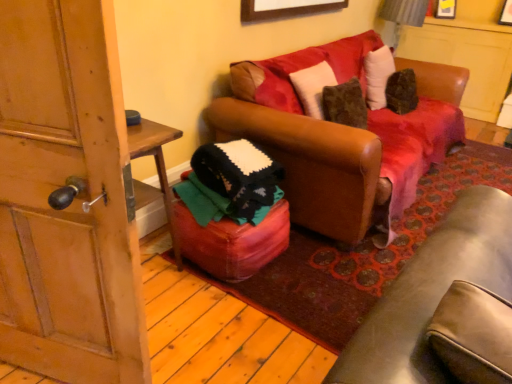
Question: From the image's perspective, is brown leather couch at center over wooden door at left?

Choices:
 (A) no
 (B) yes

Answer: (B)

Question: Is brown leather couch at center facing towards wooden door at left?

Choices:
 (A) no
 (B) yes

Answer: (A)

Question: Is brown leather couch at center shorter than wooden door at left?

Choices:
 (A) yes
 (B) no

Answer: (A)

Question: Does brown leather couch at center touch wooden door at left?

Choices:
 (A) no
 (B) yes

Answer: (A)

Question: Is brown leather couch at center not within wooden door at left?

Choices:
 (A) no
 (B) yes

Answer: (B)

Question: From the image's perspective, does brown leather couch at center appear lower than wooden door at left?

Choices:
 (A) no
 (B) yes

Answer: (A)

Question: Does wooden picture frame at upper center turn towards leather ottoman at center?

Choices:
 (A) yes
 (B) no

Answer: (B)

Question: Does wooden picture frame at upper center have a lesser height compared to leather ottoman at center?

Choices:
 (A) yes
 (B) no

Answer: (A)

Question: Is wooden picture frame at upper center looking in the opposite direction of leather ottoman at center?

Choices:
 (A) yes
 (B) no

Answer: (B)

Question: From the image's perspective, would you say wooden picture frame at upper center is positioned over leather ottoman at center?

Choices:
 (A) yes
 (B) no

Answer: (A)

Question: Considering the relative positions of wooden picture frame at upper center and leather ottoman at center in the image provided, is wooden picture frame at upper center to the left of leather ottoman at center from the viewer's perspective?

Choices:
 (A) no
 (B) yes

Answer: (A)

Question: Is wooden picture frame at upper center not within leather ottoman at center?

Choices:
 (A) yes
 (B) no

Answer: (A)

Question: Does wooden picture frame at upper center have a greater height compared to wooden door at left?

Choices:
 (A) no
 (B) yes

Answer: (A)